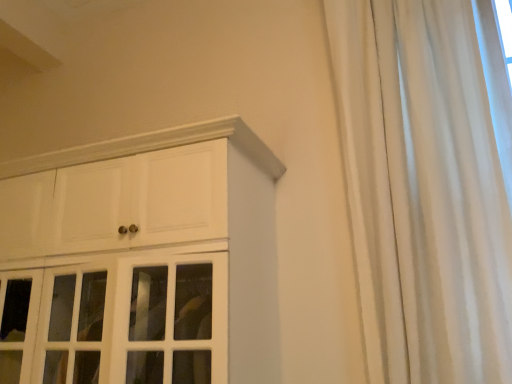
This screenshot has height=384, width=512. Describe the element at coordinates (423, 191) in the screenshot. I see `white silky curtain at right` at that location.

Where is `white silky curtain at right`? white silky curtain at right is located at coordinates (423, 191).

Describe the element at coordinates (143, 260) in the screenshot. I see `white glossy cabinet at upper left` at that location.

Locate an element on the screen. The image size is (512, 384). white glossy cabinet at upper left is located at coordinates (143, 260).

Locate an element on the screen. white silky curtain at right is located at coordinates (423, 191).

Is white silky curtain at right to the left of white glossy cabinet at upper left from the viewer's perspective?

No, white silky curtain at right is not to the left of white glossy cabinet at upper left.

Does white silky curtain at right come behind white glossy cabinet at upper left?

No, it is in front of white glossy cabinet at upper left.

Is point (375, 307) farther from camera compared to point (147, 370)?

Yes, point (375, 307) is farther from viewer.

From the image's perspective, does white silky curtain at right appear higher than white glossy cabinet at upper left?

Indeed, from the image's perspective, white silky curtain at right is shown above white glossy cabinet at upper left.

From a real-world perspective, is white silky curtain at right located beneath white glossy cabinet at upper left?

No.

Which object is wider, white silky curtain at right or white glossy cabinet at upper left?

white glossy cabinet at upper left is wider.

Considering the relative sizes of white silky curtain at right and white glossy cabinet at upper left in the image provided, is white silky curtain at right shorter than white glossy cabinet at upper left?

Incorrect, the height of white silky curtain at right does not fall short of that of white glossy cabinet at upper left.

Who is smaller, white silky curtain at right or white glossy cabinet at upper left?

white silky curtain at right is smaller.

Would you say white glossy cabinet at upper left is part of white silky curtain at right's contents?

No, white silky curtain at right does not contain white glossy cabinet at upper left.

Is white silky curtain at right far away from white glossy cabinet at upper left?

No.

Could you tell me if white silky curtain at right is facing white glossy cabinet at upper left?

No, white silky curtain at right is not turned towards white glossy cabinet at upper left.

The height and width of the screenshot is (384, 512). In order to click on curtain located on the right of white glossy cabinet at upper left in this screenshot , I will do `click(423, 191)`.

Which object is positioned more to the left, white glossy cabinet at upper left or white silky curtain at right?

From the viewer's perspective, white glossy cabinet at upper left appears more on the left side.

Is white glossy cabinet at upper left positioned in front of white silky curtain at right?

No.

Considering the points (29, 304) and (469, 90), which point is behind, point (29, 304) or point (469, 90)?

The point (29, 304) is more distant.

From the image's perspective, between white glossy cabinet at upper left and white silky curtain at right, who is located below?

white glossy cabinet at upper left, from the image's perspective.

From a real-world perspective, who is located lower, white glossy cabinet at upper left or white silky curtain at right?

From a 3D spatial view, white glossy cabinet at upper left is below.

Is white glossy cabinet at upper left thinner than white silky curtain at right?

Incorrect, the width of white glossy cabinet at upper left is not less than that of white silky curtain at right.

Who is shorter, white glossy cabinet at upper left or white silky curtain at right?

white glossy cabinet at upper left.

Can you confirm if white glossy cabinet at upper left is bigger than white silky curtain at right?

Yes, white glossy cabinet at upper left is bigger than white silky curtain at right.

Could white silky curtain at right be considered to be inside white glossy cabinet at upper left?

No, white glossy cabinet at upper left does not contain white silky curtain at right.

Is white glossy cabinet at upper left touching white silky curtain at right?

There is a gap between white glossy cabinet at upper left and white silky curtain at right.

Could you tell me if white glossy cabinet at upper left is turned towards white silky curtain at right?

No, white glossy cabinet at upper left is not turned towards white silky curtain at right.

How many degrees apart are the facing directions of white glossy cabinet at upper left and white silky curtain at right?

white glossy cabinet at upper left and white silky curtain at right are facing 1.97e-05 degrees away from each other.

Image resolution: width=512 pixels, height=384 pixels. There is a white glossy cabinet at upper left. Identify the location of curtain above it (from a real-world perspective). (423, 191).

The image size is (512, 384). In the image, there is a white silky curtain at right. Identify the location of cupboard below it (from the image's perspective). (143, 260).

In order to click on curtain above the white glossy cabinet at upper left (from the image's perspective) in this screenshot , I will do `click(423, 191)`.